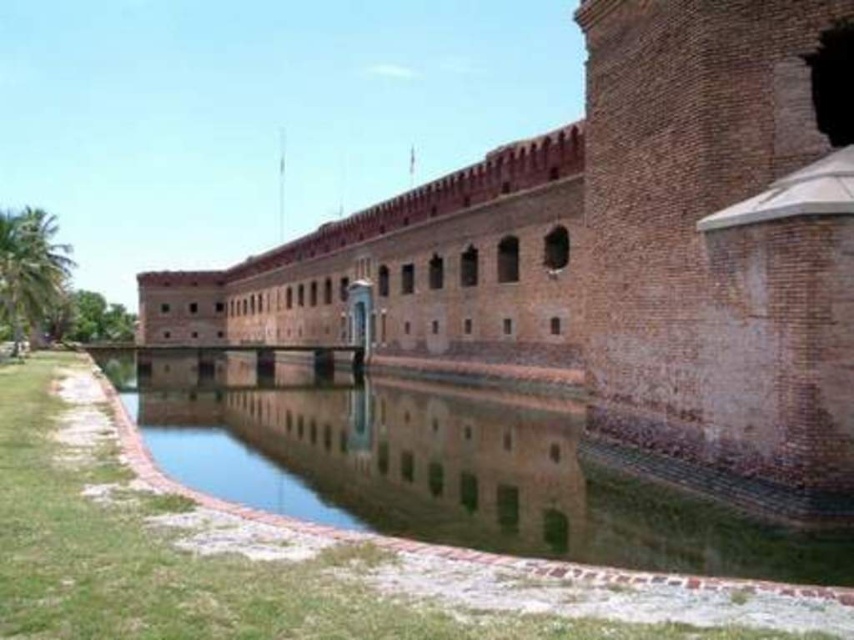
You are standing at point (621,256) in the image of the historic brick structure. What object is directly beneath your feet?

The brown brick wall at center is directly beneath the point (621,256).

You are a maintenance worker tasked with inspecting the brown brick wall at center and the clear water at center. From your vantage point, which object is positioned higher?

The brown brick wall at center is above clear water at center, so the brown brick wall at center is higher.

Looking at this image, you are a visitor standing in front of the historic brick structure. You notice the brown brick wall at center and the clear water at center. Which object is higher in position from the ground?

The brown brick wall at center is taller than the clear water at center, so the brown brick wall at center is higher in position from the ground.